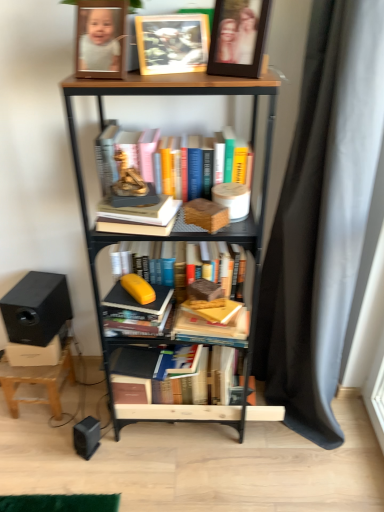
Identify the location of vacant space underneath black fabric curtain at right (from a real-world perspective). The width and height of the screenshot is (384, 512). [302, 439].